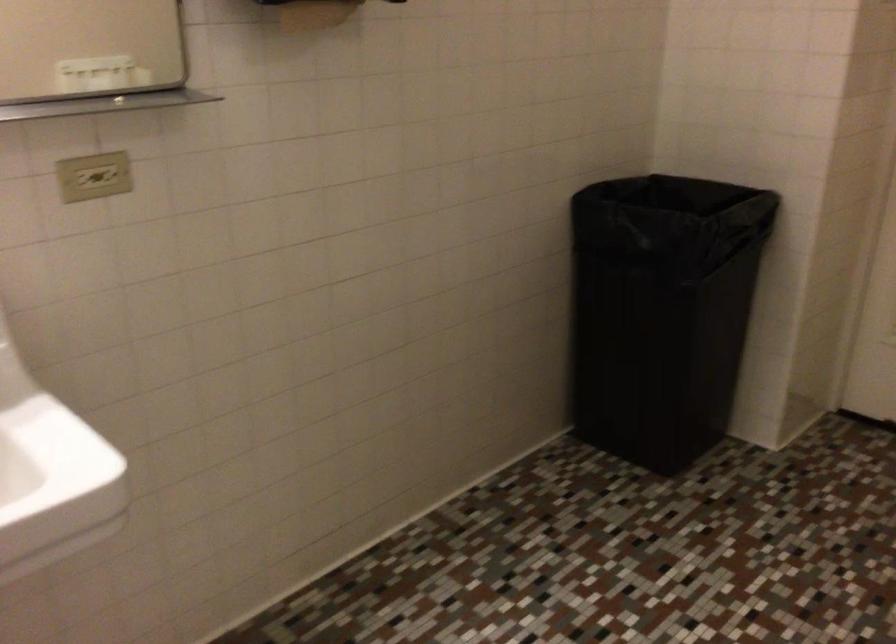
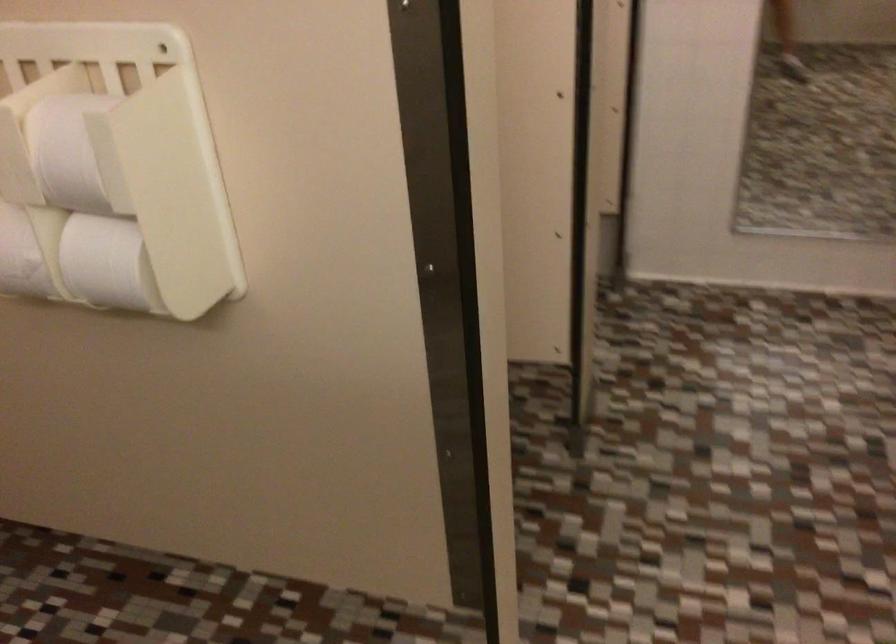
Based on the continuous images, in which direction is the camera rotating?

The camera rotated toward right-down.